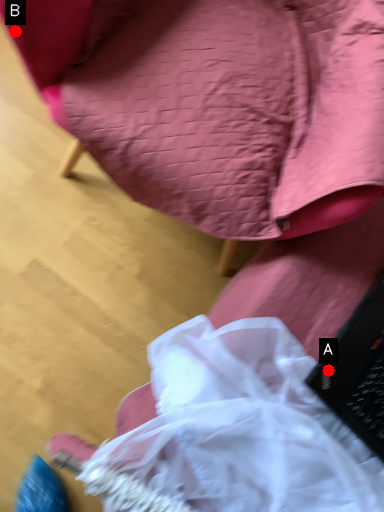
Question: Two points are circled on the image, labeled by A and B beside each circle. Which of the following is the closest to the observer?

Choices:
 (A) A is closer
 (B) B is closer

Answer: (B)